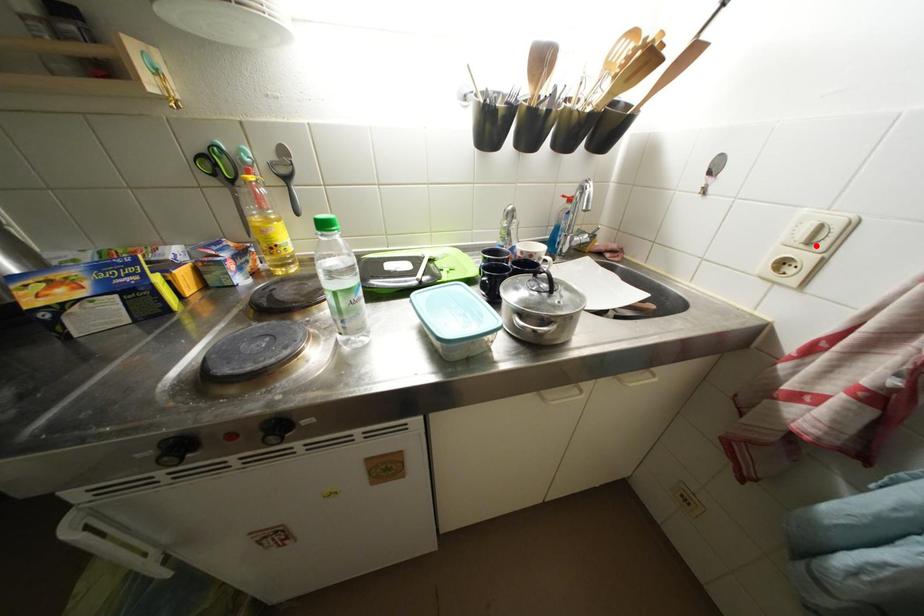
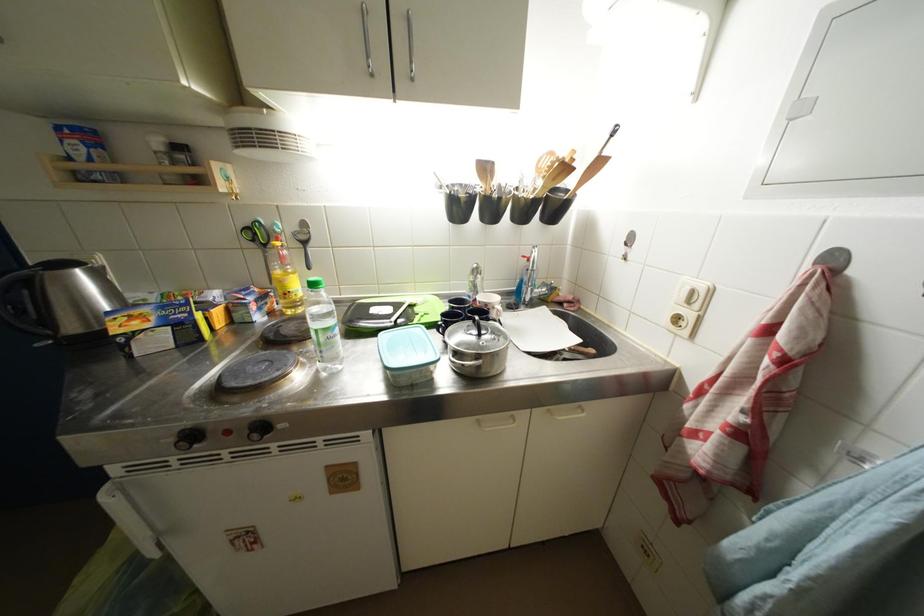
Where in the second image is the point corresponding to the highlighted location from the first image?

(696, 306)